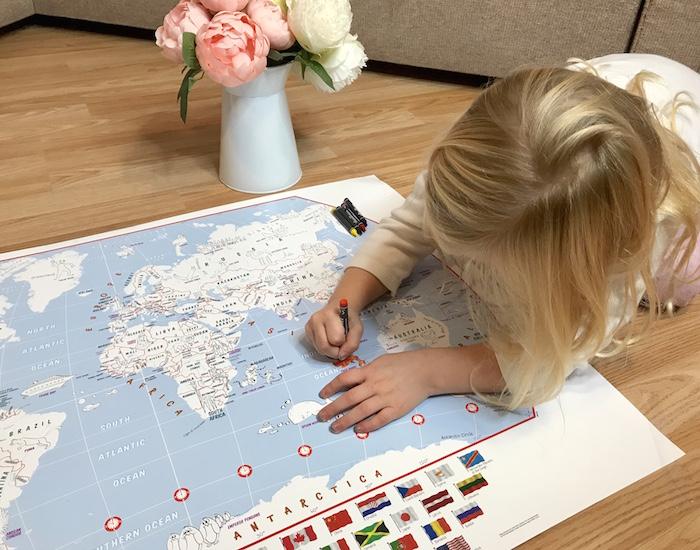
Locate an element on the screen. furniture is located at coordinates (467, 14), (14, 8), (87, 8), (666, 23).